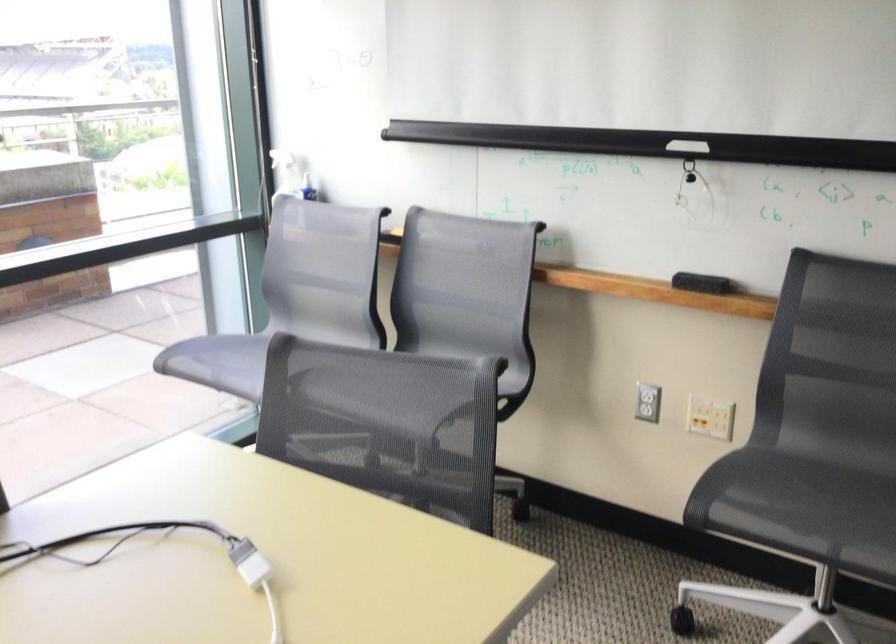
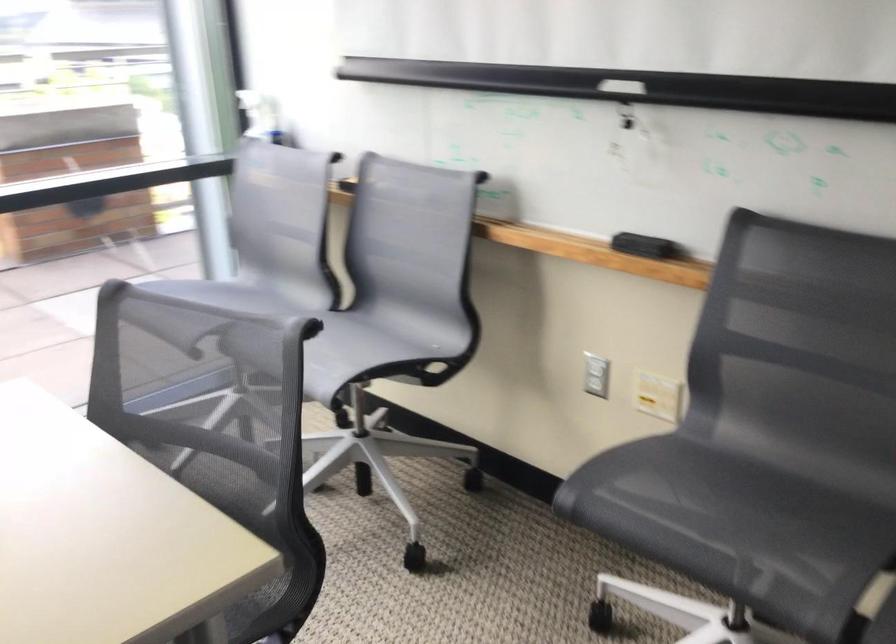
Find the pixel in the second image that matches pixel 512 231 in the first image.

(457, 182)